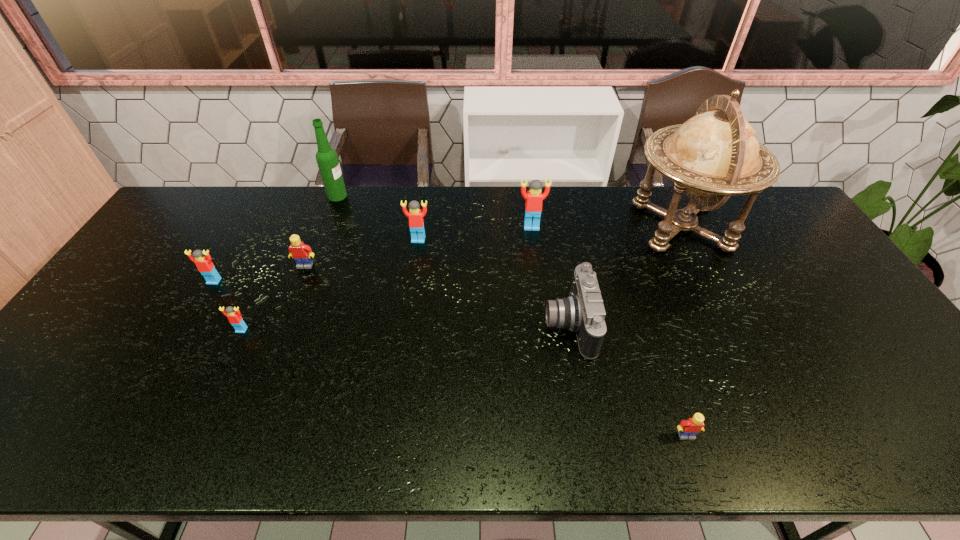
Select which Lego appears as the second closest to the nearest Lego. Please provide its 2D coordinates. Your answer should be formatted as a tuple, i.e. [(x, y)], where the tuple contains the x and y coordinates of a point satisfying the conditions above.

[(416, 223)]

Choose which red Lego is the fourth nearest neighbor to the camera. Please provide its 2D coordinates. Your answer should be formatted as a tuple, i.e. [(x, y)], where the tuple contains the x and y coordinates of a point satisfying the conditions above.

[(204, 265)]

Find the location of a particular element. Image resolution: width=960 pixels, height=540 pixels. red Lego that is the second closest to the leftmost object is located at coordinates (416, 223).

I want to click on vacant space that satisfies the following two spatial constraints: 1. on the front-facing side of the black camera; 2. on the face of the second red Lego from left to right, so click(x=569, y=330).

Where is `vacant position in the image that satisfies the following two spatial constraints: 1. on the front-facing side of the globe; 2. on the face of the nearest red Lego`? vacant position in the image that satisfies the following two spatial constraints: 1. on the front-facing side of the globe; 2. on the face of the nearest red Lego is located at coordinates (732, 330).

Find the location of a particular element. This screenshot has height=540, width=960. vacant space that satisfies the following two spatial constraints: 1. on the front-facing side of the globe; 2. on the face of the fifth shortest Lego is located at coordinates (688, 240).

The image size is (960, 540). Identify the location of vacant area that satisfies the following two spatial constraints: 1. on the front-facing side of the globe; 2. on the front-facing side of the left yellow Lego. (701, 266).

Locate an element on the screen. free space that satisfies the following two spatial constraints: 1. on the front-facing side of the black camera; 2. on the face of the nearest red Lego is located at coordinates (569, 330).

Identify the location of free space that satisfies the following two spatial constraints: 1. on the front-facing side of the tallest object; 2. on the face of the fifth nearest Lego. (688, 240).

Locate an element on the screen. vacant area in the image that satisfies the following two spatial constraints: 1. on the front-facing side of the globe; 2. on the face of the third nearest Lego is located at coordinates (708, 281).